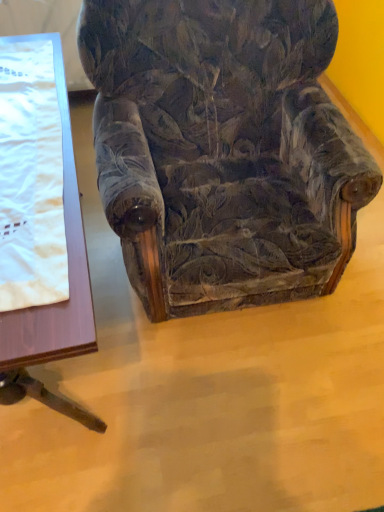
I want to click on vacant space in front of velvet floral-patterned armchair at center, so (x=244, y=401).